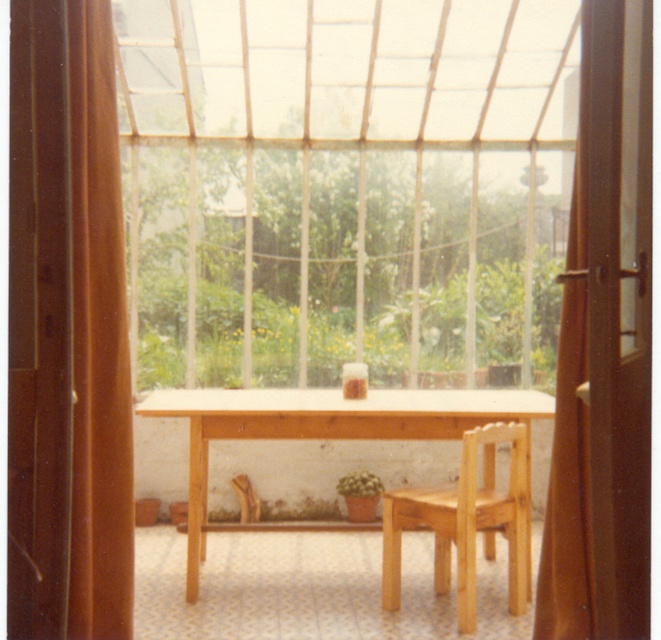
Question: Is transparent glass window at center closer to camera compared to green leafy plant at center?

Choices:
 (A) yes
 (B) no

Answer: (A)

Question: Which point appears closest to the camera in this image?

Choices:
 (A) (315, 522)
 (B) (580, 634)

Answer: (B)

Question: Does green leafy plant at center appear on the right side of light brown wooden table at center?

Choices:
 (A) no
 (B) yes

Answer: (A)

Question: Based on their relative distances, which object is farther from the brown fabric curtain at right?

Choices:
 (A) light brown wooden table at center
 (B) brown fabric curtain at left
 (C) green leafy plant at center
 (D) transparent glass window at center

Answer: (C)

Question: Can you confirm if transparent glass window at center is wider than green matte plant at center?

Choices:
 (A) no
 (B) yes

Answer: (B)

Question: Based on their relative distances, which object is nearer to the brown fabric curtain at left?

Choices:
 (A) transparent glass window at center
 (B) brown fabric curtain at right
 (C) green leafy plant at center

Answer: (B)